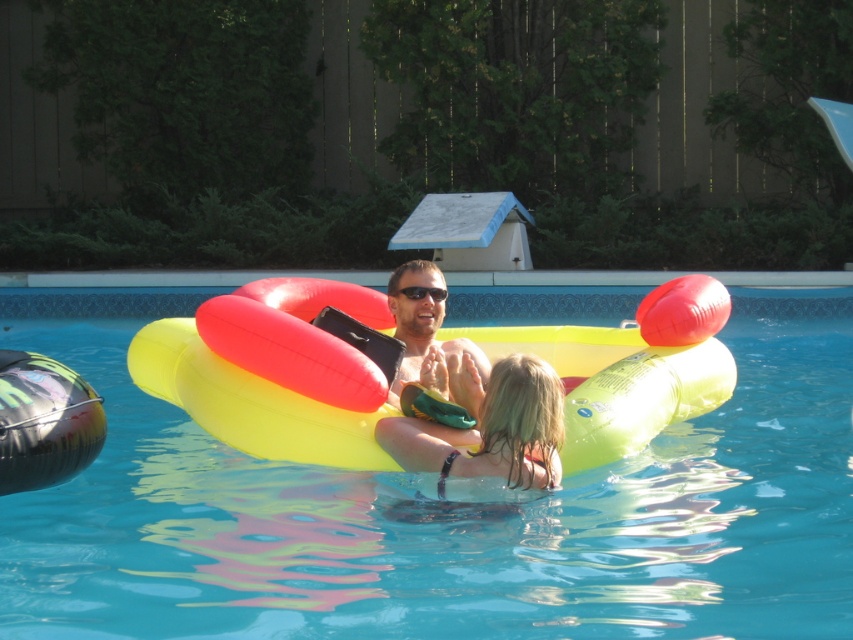
Question: Does yellow rubber ring at center have a lesser width compared to black plastic sunglasses at center?

Choices:
 (A) no
 (B) yes

Answer: (A)

Question: Among these objects, which one is nearest to the camera?

Choices:
 (A) shiny blonde hair at center
 (B) black plastic sunglasses at center
 (C) matte yellow float at center

Answer: (A)

Question: Which point appears farthest from the camera in this image?

Choices:
 (A) (437, 364)
 (B) (846, 388)

Answer: (B)

Question: Which of the following is the farthest from the observer?

Choices:
 (A) yellow rubber ring at center
 (B) black plastic sunglasses at center

Answer: (B)

Question: Can you confirm if matte yellow float at center is positioned below black plastic sunglasses at center?

Choices:
 (A) no
 (B) yes

Answer: (B)

Question: Is yellow rubber ring at center wider than matte yellow float at center?

Choices:
 (A) yes
 (B) no

Answer: (A)